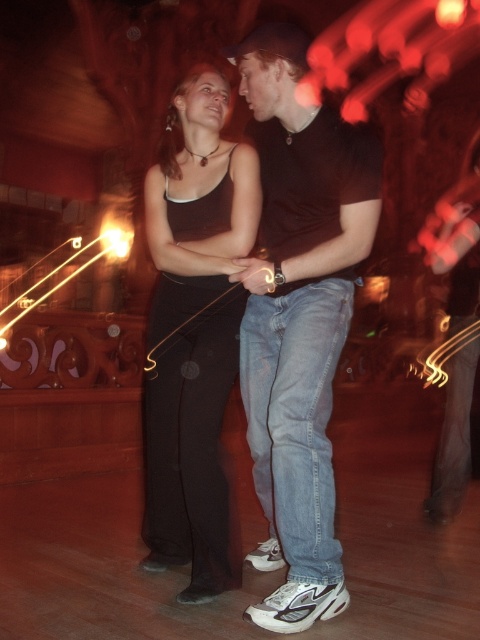
Question: Which point is closer to the camera?

Choices:
 (A) (194, 296)
 (B) (272, 26)

Answer: (B)

Question: Among these objects, which one is farthest from the camera?

Choices:
 (A) denim jeans at center
 (B) matte black tank top at center

Answer: (B)

Question: Is denim jeans at center bigger than matte black tank top at center?

Choices:
 (A) yes
 (B) no

Answer: (A)

Question: Can you confirm if denim jeans at center is positioned above matte black tank top at center?

Choices:
 (A) yes
 (B) no

Answer: (B)

Question: Which object is closer to the camera taking this photo?

Choices:
 (A) denim jeans at center
 (B) matte black tank top at center

Answer: (A)

Question: Observing the image, what is the correct spatial positioning of denim jeans at center in reference to matte black tank top at center?

Choices:
 (A) left
 (B) right

Answer: (B)